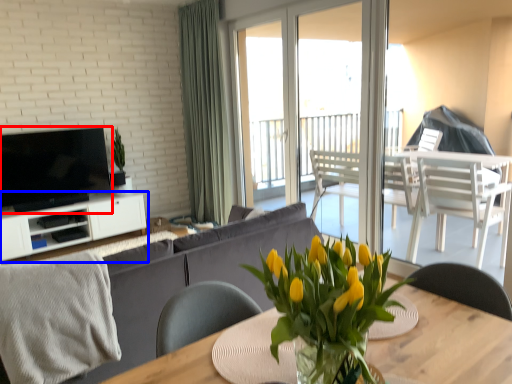
Question: Among these objects, which one is nearest to the camera, television (highlighted by a red box) or cabinetry (highlighted by a blue box)?

Choices:
 (A) television
 (B) cabinetry

Answer: (A)